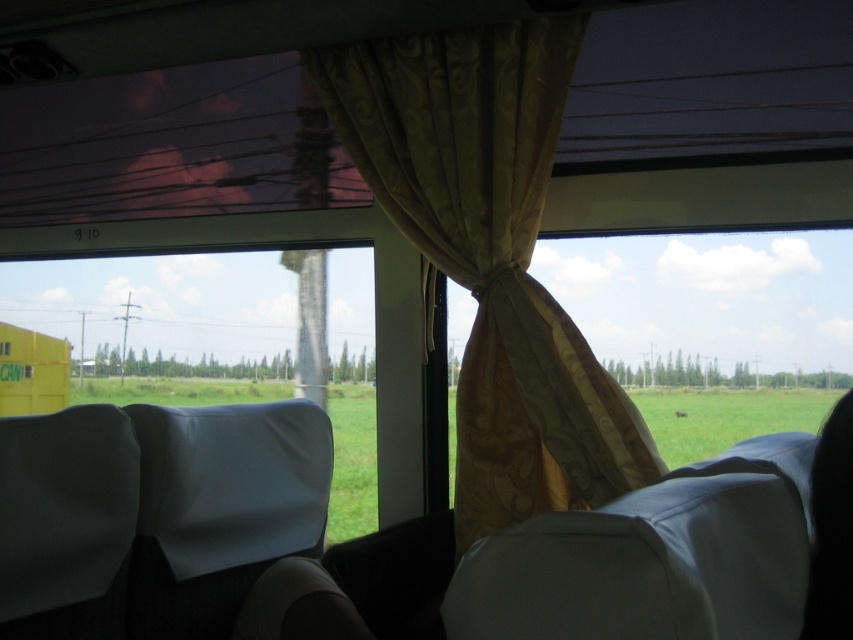
Locate an element on the screen. This screenshot has height=640, width=853. gold silk curtain at center is located at coordinates (490, 257).

What do you see at coordinates (490, 257) in the screenshot?
I see `gold silk curtain at center` at bounding box center [490, 257].

Is point (474, 321) closer to viewer compared to point (297, 360)?

Yes, point (474, 321) is in front of point (297, 360).

What are the coordinates of `gold silk curtain at center` in the screenshot? It's located at (490, 257).

Identify the location of gold silk curtain at center. (490, 257).

Can you confirm if gold silk curtain at center is thinner than white fabric chair at center?

No, gold silk curtain at center is not thinner than white fabric chair at center.

Who is more forward, (479, 483) or (231, 502)?

Point (231, 502)

The image size is (853, 640). In order to click on gold silk curtain at center in this screenshot , I will do pos(490,257).

Which of these two, green matte window at center or white fabric chair at center, stands taller?

Standing taller between the two is green matte window at center.

Between green matte window at center and white fabric chair at center, which one appears on the left side from the viewer's perspective?

green matte window at center

Does point (354, 320) lie in front of point (265, 481)?

No, (354, 320) is further to viewer.

Identify the location of green matte window at center. The width and height of the screenshot is (853, 640). (216, 342).